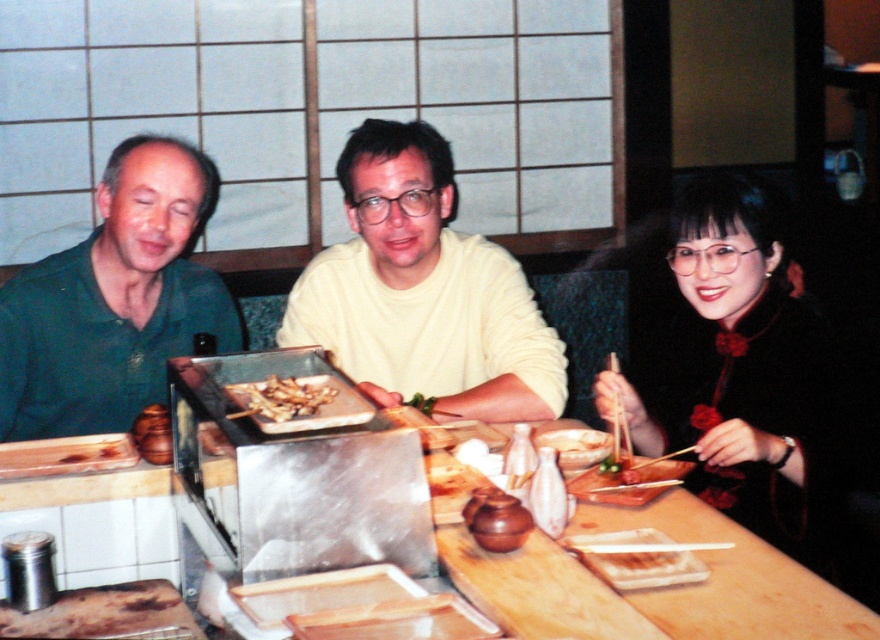
Question: Is yellow matte sweater at center wider than green matte shirt at left?

Choices:
 (A) yes
 (B) no

Answer: (A)

Question: Considering the relative positions of green matte shirt at left and brown glossy meat at center in the image provided, where is green matte shirt at left located with respect to brown glossy meat at center?

Choices:
 (A) above
 (B) below

Answer: (A)

Question: Is the position of black velvet dress at right less distant than that of brown glossy meat at center?

Choices:
 (A) yes
 (B) no

Answer: (B)

Question: Considering the real-world distances, which object is closest to the brown glossy meat at center?

Choices:
 (A) yellow matte sweater at center
 (B) green matte shirt at left
 (C) black velvet dress at right

Answer: (A)

Question: Which object is closer to the camera taking this photo?

Choices:
 (A) green matte shirt at left
 (B) yellow matte sweater at center
 (C) brown glossy meat at center
 (D) black velvet dress at right

Answer: (C)

Question: Which is nearer to the brown glossy meat at center?

Choices:
 (A) green matte shirt at left
 (B) yellow matte sweater at center

Answer: (B)